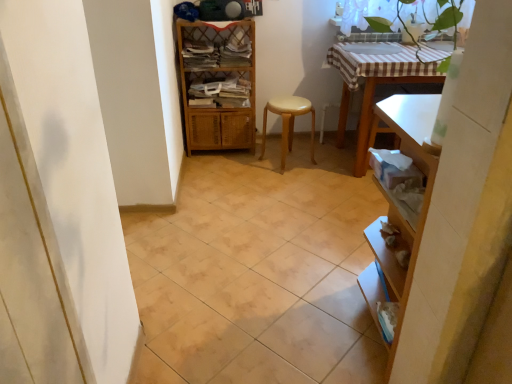
At what (x,y) coordinates should I click in order to perform the action: click on vacant space underneath light brown wooden stool at center (from a real-world perspective). Please return your answer as a coordinate pair (x, y). The height and width of the screenshot is (384, 512). Looking at the image, I should click on (287, 161).